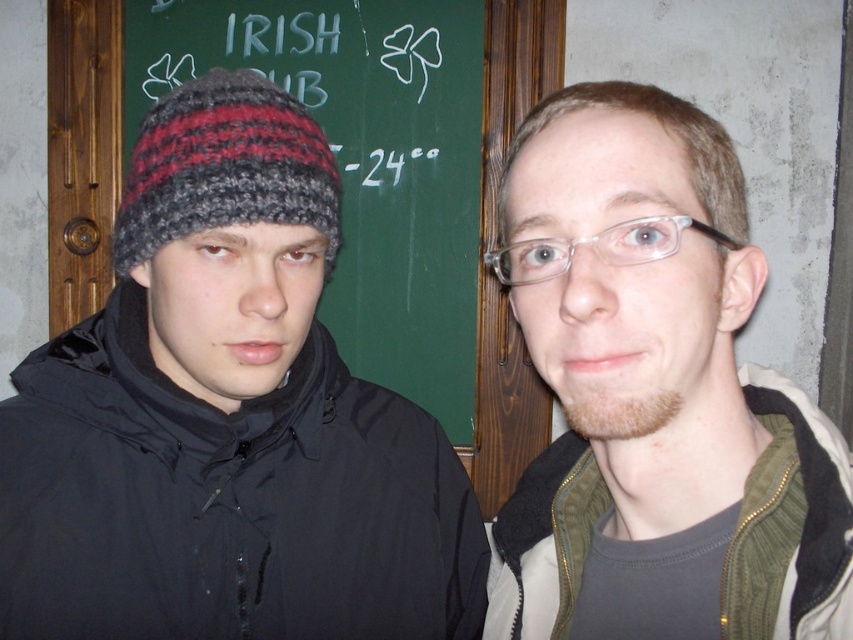
You are a photographer trying to capture both the matte green jacket at center and the knitted woolen beanie at left in a single photo. The camera you are using has a maximum focus range of 25 centimeters. Will you be able to capture both objects clearly in the photo?

The matte green jacket at center and the knitted woolen beanie at left are 23.63 centimeters apart from each other, which is within the camera maximum focus range of 25 centimeters. Therefore, both objects can be captured clearly in the photo.

You are standing in front of the chalkboard and want to place a new decoration between the two points marked as point [590,552] and point [219,144]. Which point should the decoration be closer to in order to be centered between them?

The decoration should be closer to point [219,144] because point [590,552] is in front of it, so the midpoint would be nearer to the point that is further back.